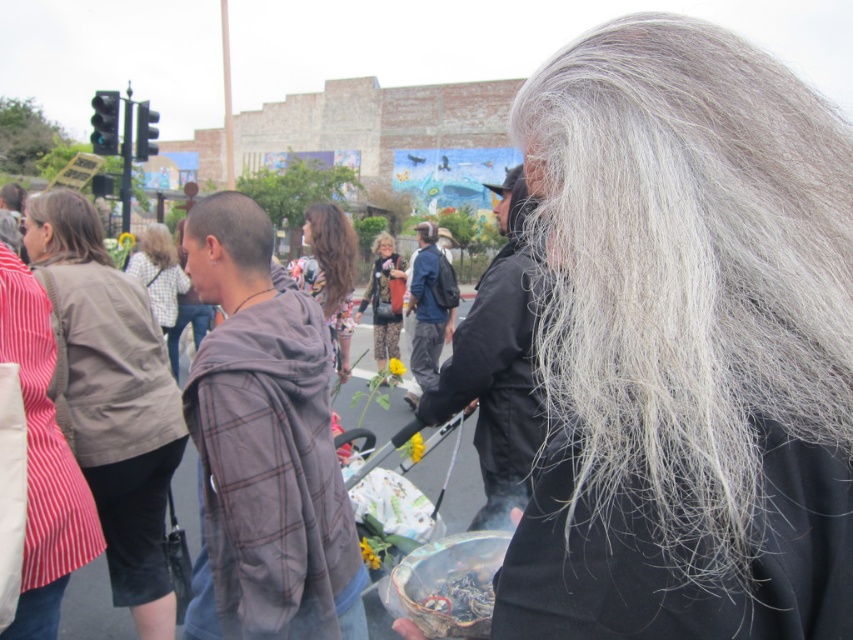
Question: Is blonde hair at upper left smaller than blondehair at center?

Choices:
 (A) no
 (B) yes

Answer: (B)

Question: Does blonde hair at upper left appear on the right side of brown matte hair at upper left?

Choices:
 (A) yes
 (B) no

Answer: (A)

Question: Can you confirm if plaid fabric hoodie at center is positioned to the left of gray silky hair at center?

Choices:
 (A) no
 (B) yes

Answer: (A)

Question: Which object is positioned closest to the gray matte hair at upper center?

Choices:
 (A) blondehair at center
 (B) blue denim jacket at center
 (C) plaid fabric hoodie at center
 (D) floral print dress at center

Answer: (D)

Question: Based on their relative distances, which object is nearer to the blue denim jacket at center?

Choices:
 (A) white textured shirt at center
 (B) gray woolen hair at upper right
 (C) blondehair at center

Answer: (A)

Question: Which point is closer to the camera?

Choices:
 (A) (236, 216)
 (B) (416, 253)
 (C) (204, 435)
 (D) (16, 204)

Answer: (C)